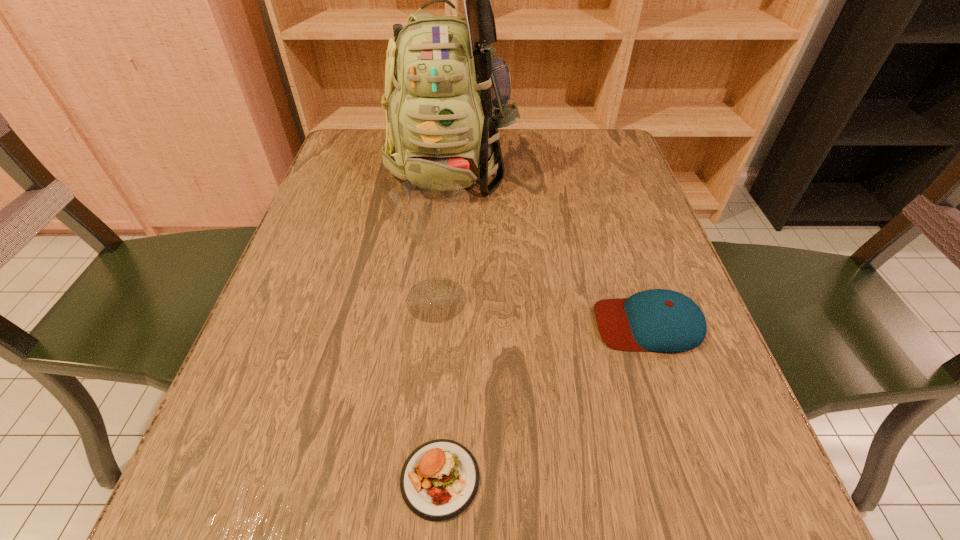
This screenshot has width=960, height=540. Find the location of `the tallest object`. the tallest object is located at coordinates (446, 95).

Locate an element on the screen. Image resolution: width=960 pixels, height=540 pixels. backpack is located at coordinates (446, 95).

This screenshot has width=960, height=540. In order to click on flute glass in this screenshot , I will do `click(427, 210)`.

The image size is (960, 540). I want to click on the rightmost object, so click(658, 320).

What are the coordinates of `baseball cap` in the screenshot? It's located at (658, 320).

Locate an element on the screen. This screenshot has width=960, height=540. the shortest object is located at coordinates (439, 480).

Image resolution: width=960 pixels, height=540 pixels. Identify the location of the nearest object. (439, 480).

This screenshot has width=960, height=540. Identify the location of free space located on the front-facing side of the farthest object. (446, 228).

This screenshot has width=960, height=540. I want to click on vacant space located 0.380m on the right of the second tallest object, so click(x=683, y=299).

Image resolution: width=960 pixels, height=540 pixels. Find the location of `vacant region located with the bill of the rightmost object facing forward`. vacant region located with the bill of the rightmost object facing forward is located at coordinates (437, 324).